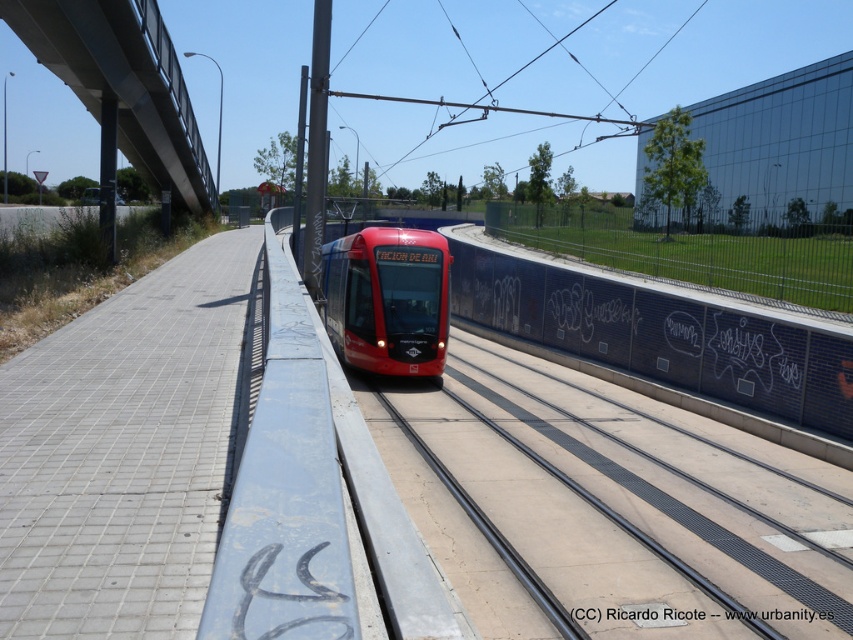
Question: Which object appears closest to the camera in this image?

Choices:
 (A) blacktexturedsign at center
 (B) matte red train at center
 (C) metal/textured bridge at upper left

Answer: (A)

Question: Where is matte red train at center located in relation to blacktexturedsign at center in the image?

Choices:
 (A) right
 (B) left

Answer: (B)

Question: Can you confirm if matte red train at center is bigger than blacktexturedsign at center?

Choices:
 (A) no
 (B) yes

Answer: (B)

Question: Which point is farther from the camera taking this photo?

Choices:
 (A) (402, 314)
 (B) (801, 612)
 (C) (171, 154)

Answer: (C)

Question: Which object is closer to the camera taking this photo?

Choices:
 (A) matte red train at center
 (B) blacktexturedsign at center

Answer: (B)

Question: Is matte red train at center closer to the viewer compared to blacktexturedsign at center?

Choices:
 (A) no
 (B) yes

Answer: (A)